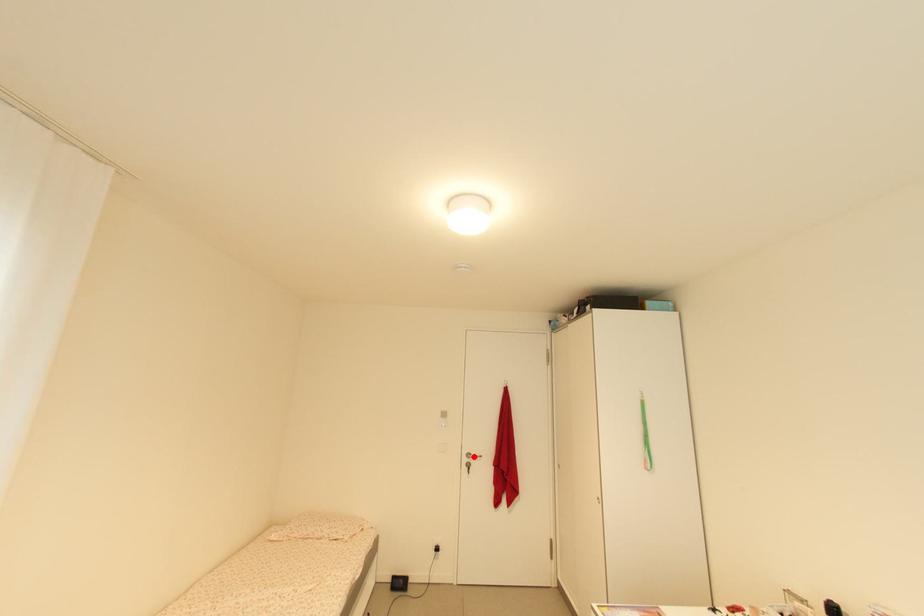
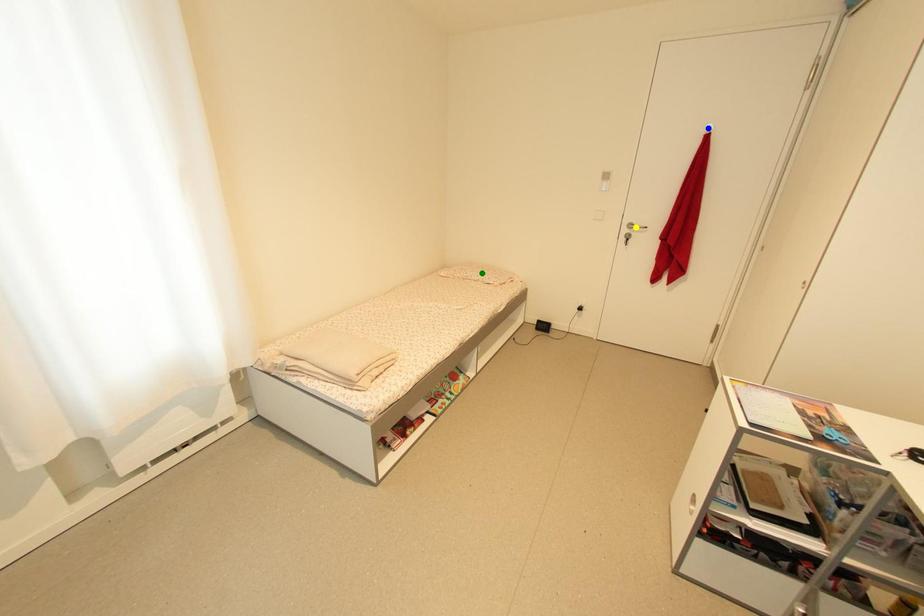
Question: I am providing you with two images of the same scene from different viewpoints. A red point is marked on the first image. You are given multiple points on the second image. Which point in image 2 represents the same 3d spot as the red point in image 1?

Choices:
 (A) green point
 (B) blue point
 (C) yellow point

Answer: (C)